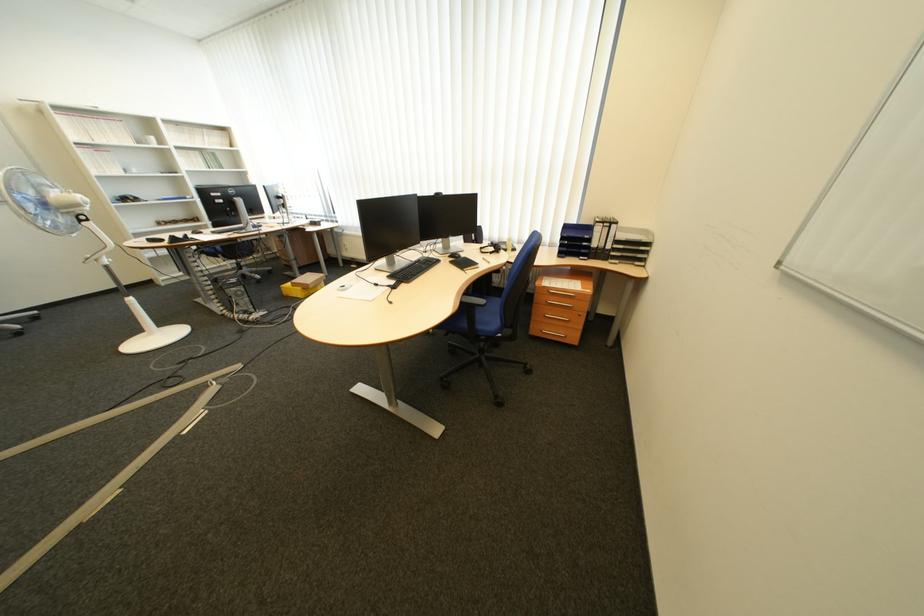
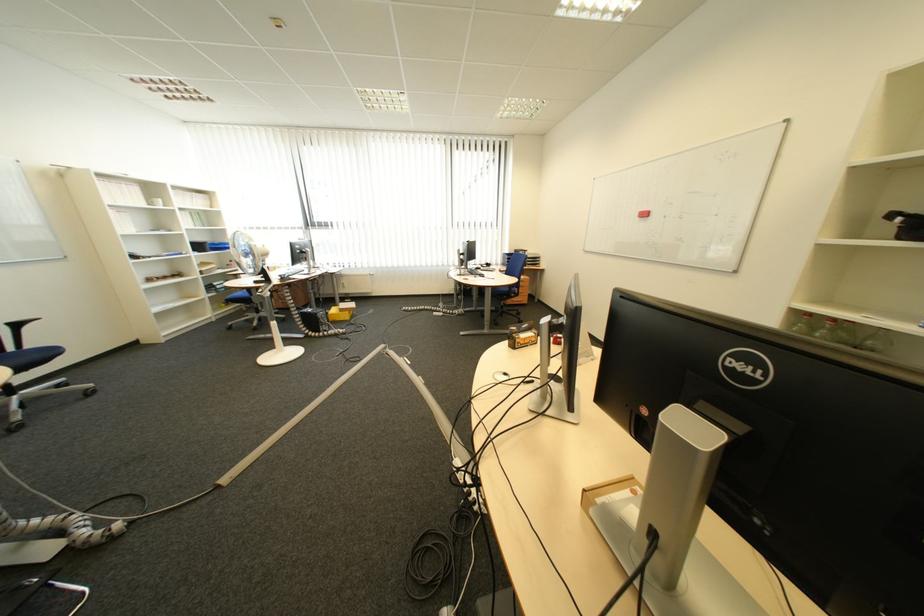
Locate, in the second image, the point that corresponds to [252,294] in the first image.

(335, 317)